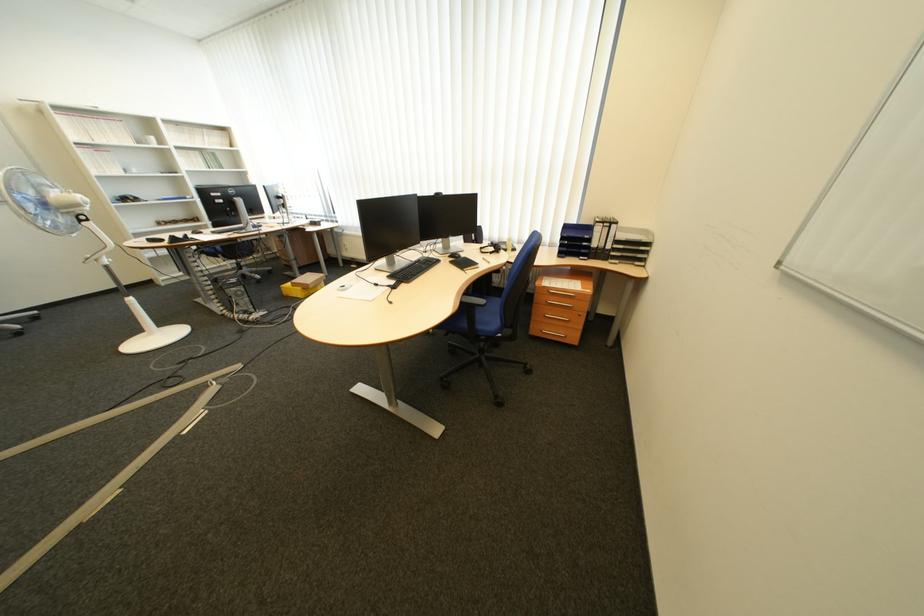
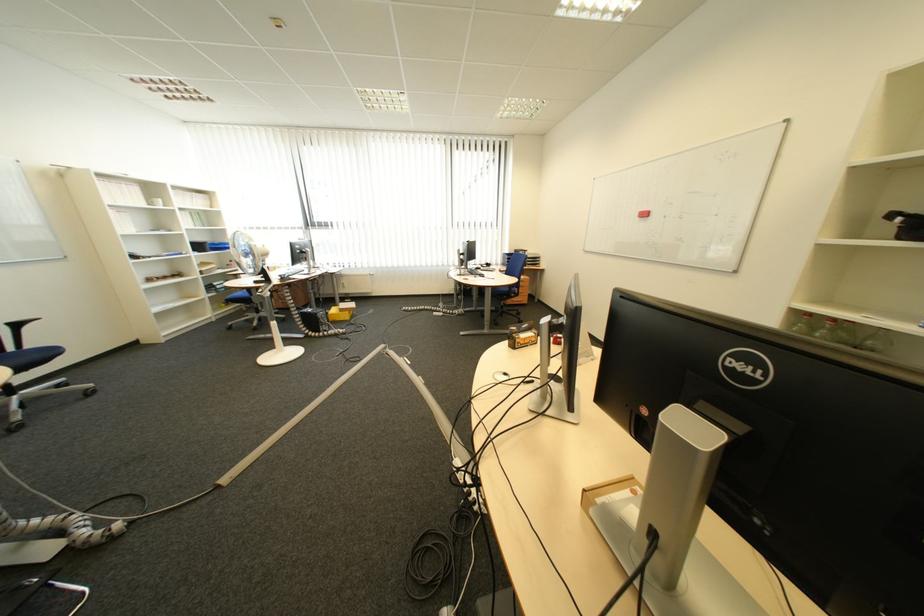
Locate, in the second image, the point that corresponds to [252,294] in the first image.

(335, 317)